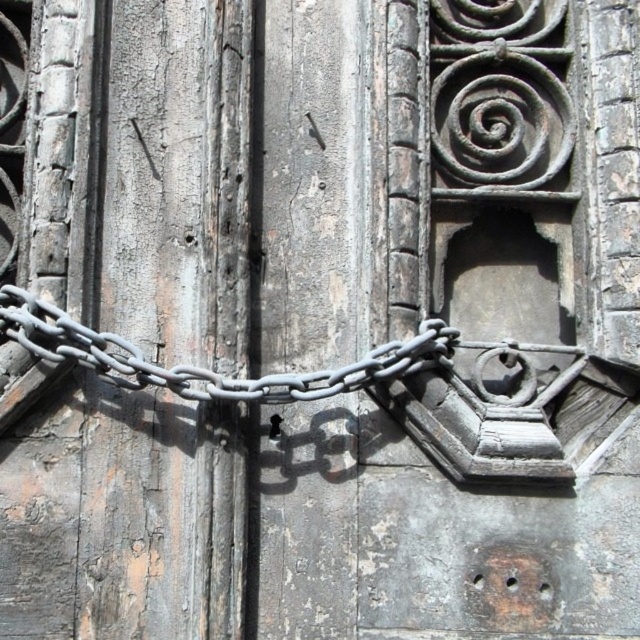
Between gray metallic chain at center and black matte padlock at center, which one is positioned higher?

→ gray metallic chain at center is above.

Does gray metallic chain at center appear on the right side of black matte padlock at center?

No, gray metallic chain at center is not to the right of black matte padlock at center.

This screenshot has height=640, width=640. I want to click on gray metallic chain at center, so click(x=204, y=369).